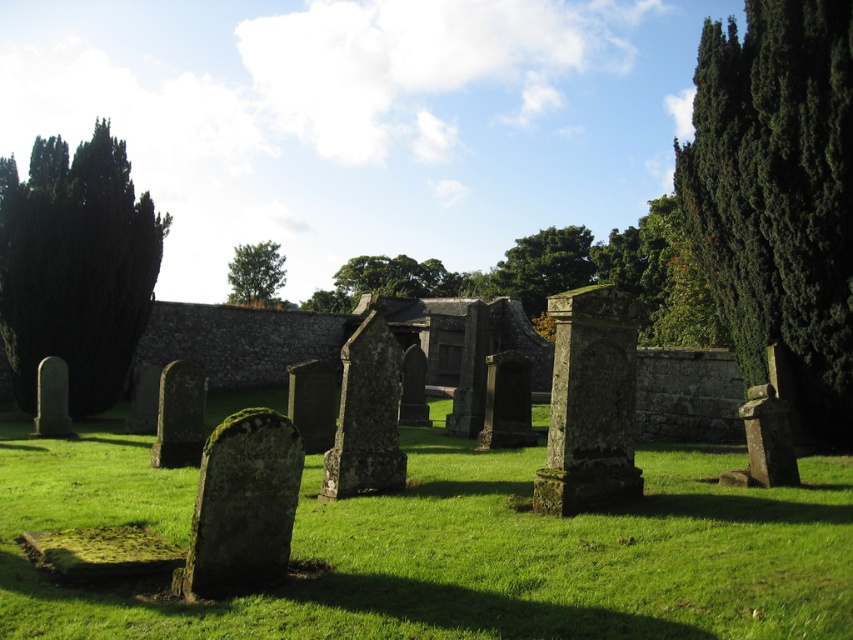
You are a landscape architect designing a new garden and want to incorporate both the green mossy stone at center and the green leafy tree at center from the image. If you want to place them in a way that maintains their relative sizes as seen in the image, which one should be placed closer to the front of the garden?

The green mossy stone at center should be placed closer to the front of the garden because it is shorter than the green leafy tree at center, which is taller. This arrangement would maintain their relative sizes as seen in the image.

You are standing in the cemetery and want to take a photo of both the green mossy grass at center and the green leafy tree at center. Which one should you focus on first to ensure both are in clear view?

You should focus on the green mossy grass at center first because it is closer to you than the green leafy tree at center, so adjusting focus from near to far will help both be in clear view.

You are standing in the cemetery and want to place a small bouquet of flowers between the two points marked as point (766, 120) and point (248, 253). Which point should you approach first to ensure the bouquet is closer to the viewer?

You should place the bouquet closer to point (766, 120) because it is closer to the viewer than point (248, 253).